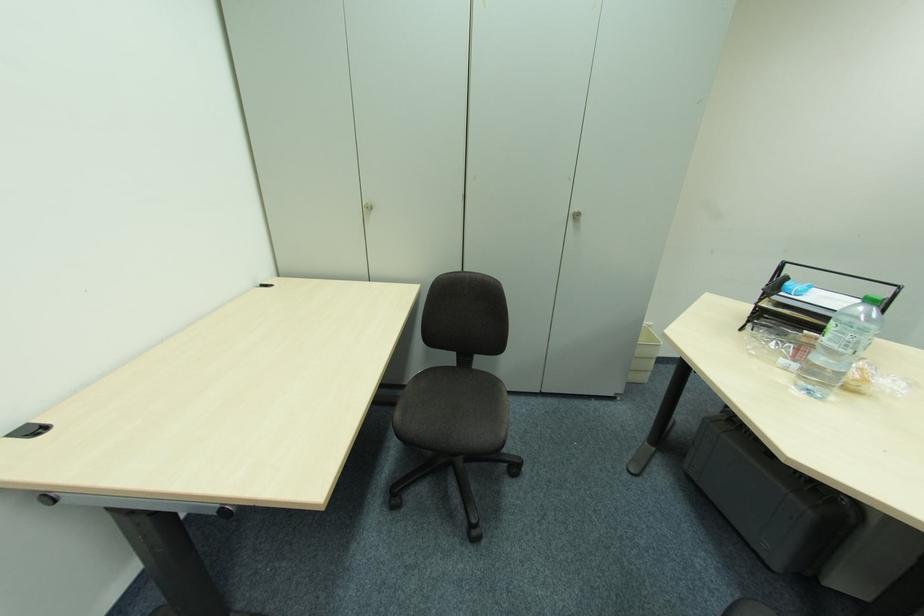
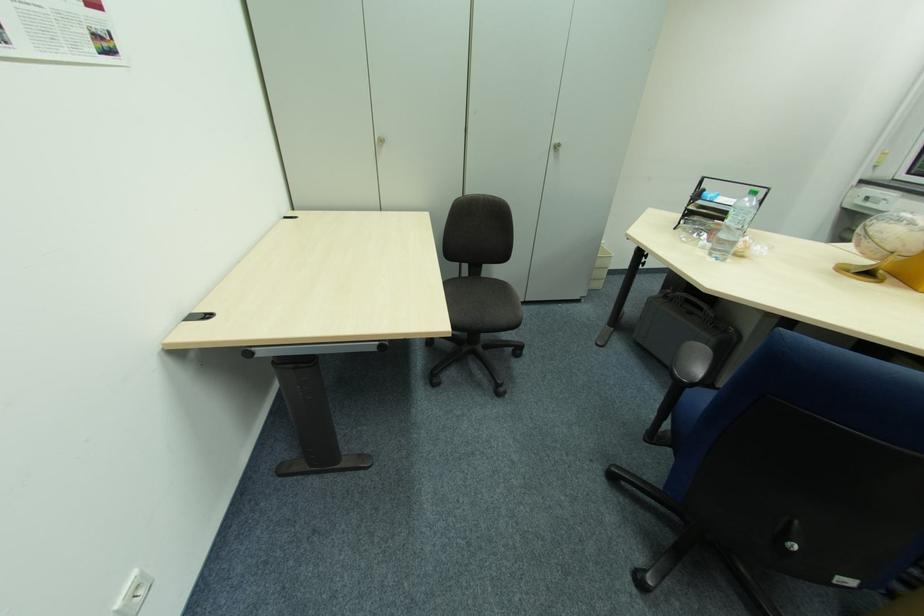
Locate, in the second image, the point that corresponds to pixel 477 371 in the first image.

(485, 278)